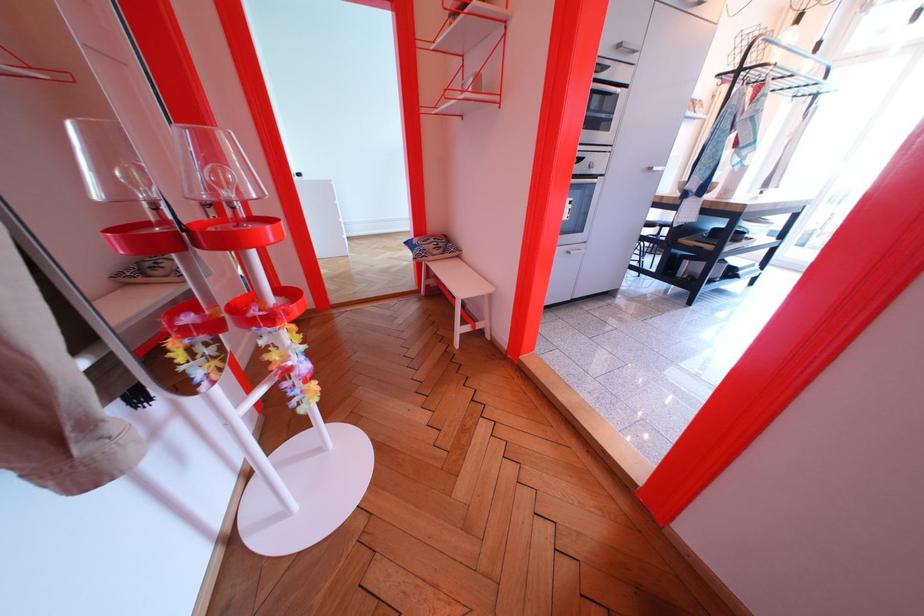
Find where to push the oven control knob. Please return your answer as a coordinate pair (x, y).

(591, 164)